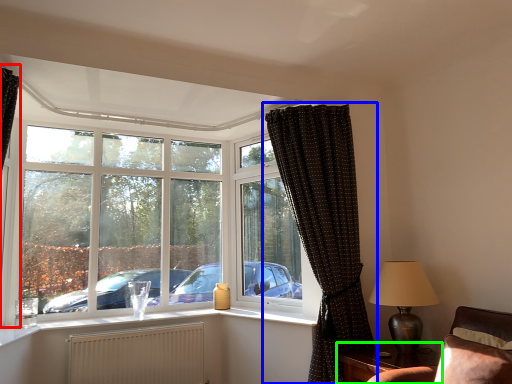
Question: Which object is positioned farthest from curtain (highlighted by a red box)? Select from curtain (highlighted by a blue box) and table (highlighted by a green box).

Choices:
 (A) curtain
 (B) table

Answer: (B)